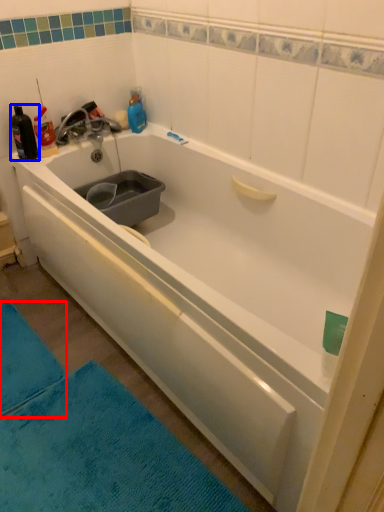
Question: Which object appears farthest to the camera in this image, bath mat (highlighted by a red box) or bottle (highlighted by a blue box)?

Choices:
 (A) bath mat
 (B) bottle

Answer: (B)